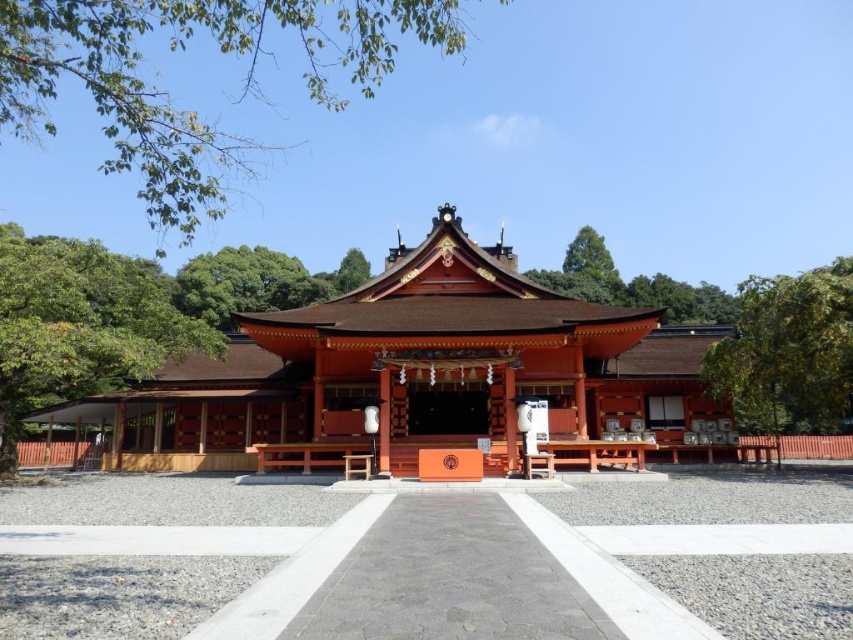
You are visiting a traditional Japanese shrine and notice the shiny red wood shrine at center and the green leafy tree at left. Which object is taller when viewed from the entrance pathway?

The green leafy tree at left is taller than the shiny red wood shrine at center.

You are standing at the base of the shrine pathway and want to take a photo of both the green leafy tree at upper center and the green leafy tree at right. Which tree is positioned higher up in the frame?

The green leafy tree at upper center is positioned higher up in the frame than the green leafy tree at right.